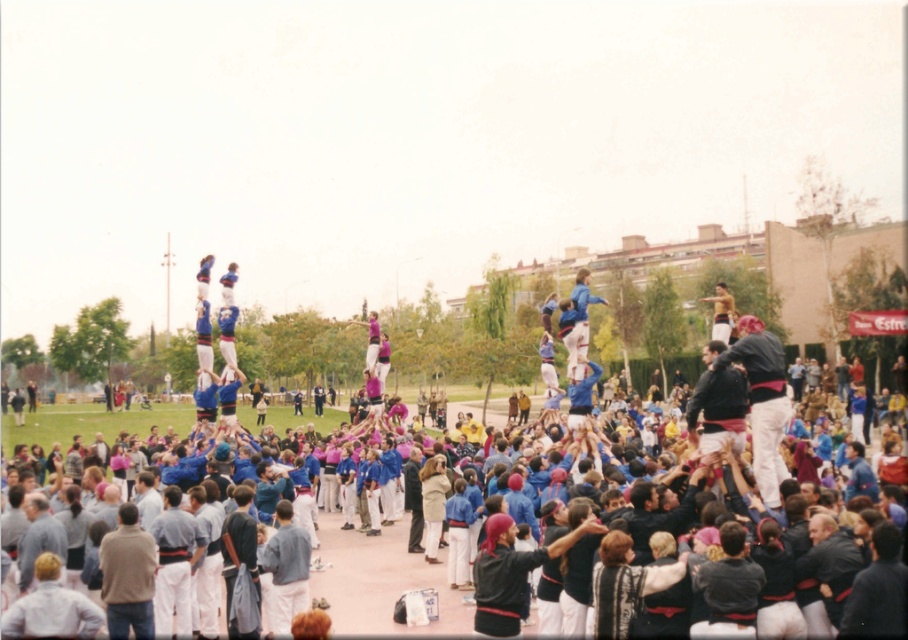
Question: Which object is positioned farthest from the dark blue fabric at center?

Choices:
 (A) blue fabric crowd at center
 (B) light beige coat at center

Answer: (B)

Question: Is the position of dark blue fabric at center less distant than that of light beige coat at center?

Choices:
 (A) yes
 (B) no

Answer: (A)

Question: Which is farther from the dark blue fabric at center?

Choices:
 (A) light beige coat at center
 (B) blue fabric crowd at center

Answer: (A)

Question: Is blue fabric crowd at center wider than dark blue fabric at center?

Choices:
 (A) no
 (B) yes

Answer: (B)

Question: From the image, what is the correct spatial relationship of blue fabric crowd at center in relation to dark blue fabric at center?

Choices:
 (A) above
 (B) below

Answer: (B)

Question: Which of the following is the farthest from the observer?

Choices:
 (A) (422, 492)
 (B) (739, 497)
 (C) (755, 365)

Answer: (A)